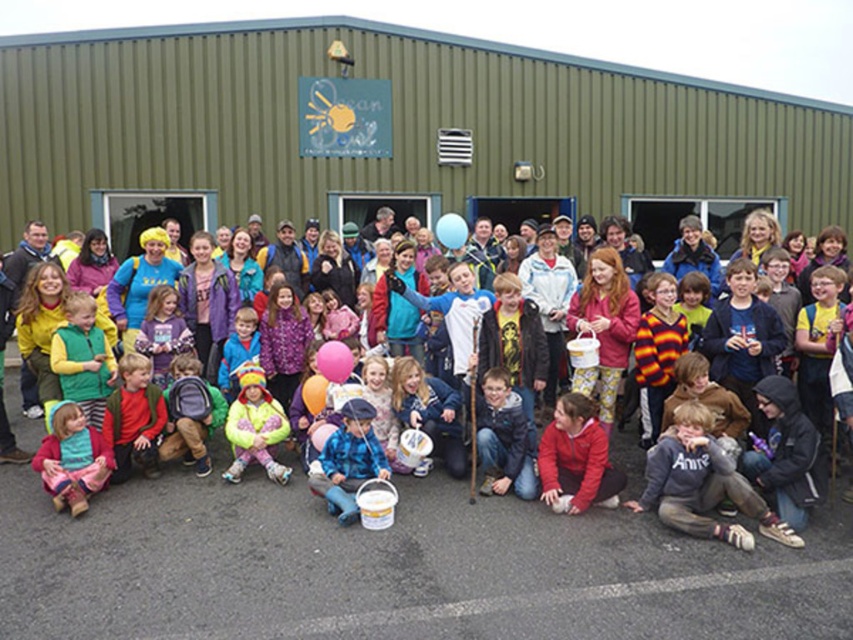
Question: Can you confirm if matte blue bucket at center is positioned below fluorescent yellow jacket at center?

Choices:
 (A) yes
 (B) no

Answer: (A)

Question: Considering the relative positions of matte pink sweater at lower left and blue glossy balloon at center in the image provided, where is matte pink sweater at lower left located with respect to blue glossy balloon at center?

Choices:
 (A) left
 (B) right

Answer: (A)

Question: Does matte yellow hat at center have a smaller size compared to fluorescent yellow jacket at center?

Choices:
 (A) no
 (B) yes

Answer: (B)

Question: Which object is closer to the camera taking this photo?

Choices:
 (A) fluorescent yellow jacket at center
 (B) pink rubber balloon at center
 (C) matte blue bucket at center
 (D) rubber pink balloon at center

Answer: (C)

Question: Which object is farther from the camera taking this photo?

Choices:
 (A) matte pink sweater at lower left
 (B) blue glossy balloon at center
 (C) matte blue bucket at center
 (D) fluorescent yellow jacket at center

Answer: (B)

Question: Which point is closer to the camera taking this photo?

Choices:
 (A) (257, 380)
 (B) (460, 230)

Answer: (A)